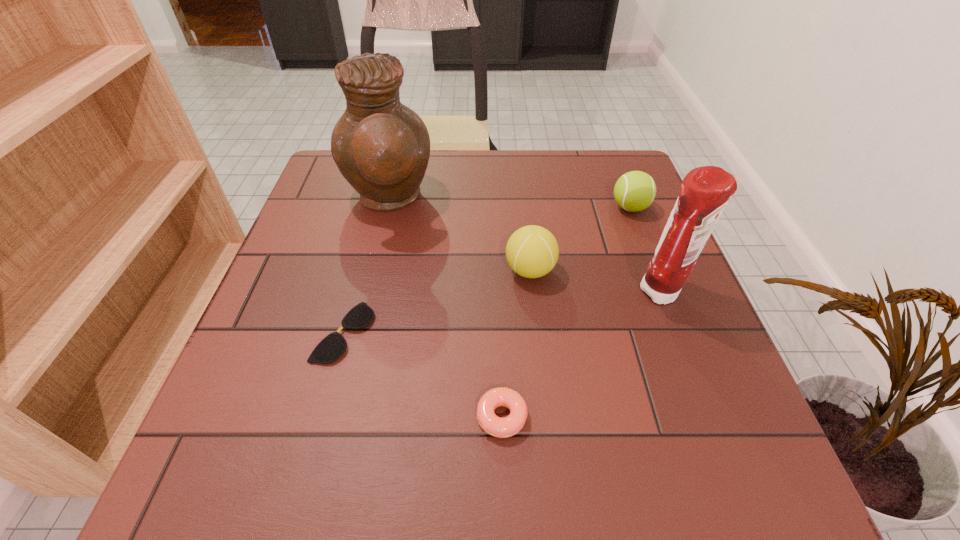
I want to click on vacant point located on the left of the farther tennis ball, so click(482, 207).

Locate an element on the screen. vacant area situated on the right of the nearest object is located at coordinates (682, 417).

The width and height of the screenshot is (960, 540). I want to click on vacant area situated on the back of the spectacles, so click(x=376, y=211).

This screenshot has width=960, height=540. Identify the location of pitcher situated at the far edge. (381, 147).

Find the location of a particular element. tennis ball at the far edge is located at coordinates (634, 191).

At what (x,y) coordinates should I click in order to perform the action: click on pitcher located in the left edge section of the desktop. Please return your answer as a coordinate pair (x, y). Looking at the image, I should click on (381, 147).

You are a GUI agent. You are given a task and a screenshot of the screen. Output one action in this format:
    pyautogui.click(x=<x>, y=<y>)
    Task: Click on the spectacles that is positioned at the left edge
    The image size is (960, 540).
    Given the screenshot: What is the action you would take?
    [331, 348]

Image resolution: width=960 pixels, height=540 pixels. In order to click on condiment located in the right edge section of the desktop in this screenshot , I will do `click(705, 191)`.

Image resolution: width=960 pixels, height=540 pixels. In order to click on tennis ball at the right edge in this screenshot , I will do `click(634, 191)`.

Identify the location of object that is at the far left corner. Image resolution: width=960 pixels, height=540 pixels. (381, 147).